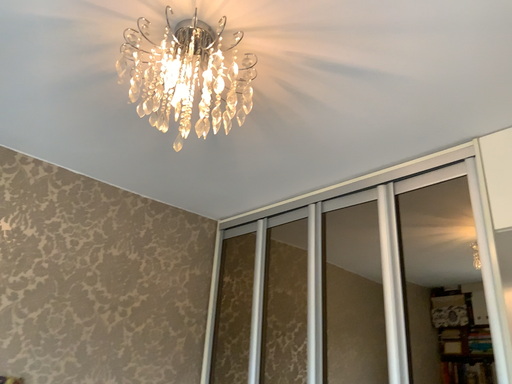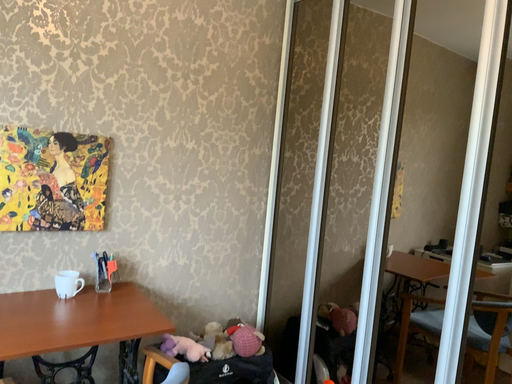
Question: Which way did the camera rotate in the video?

Choices:
 (A) rotated upward
 (B) rotated downward

Answer: (B)